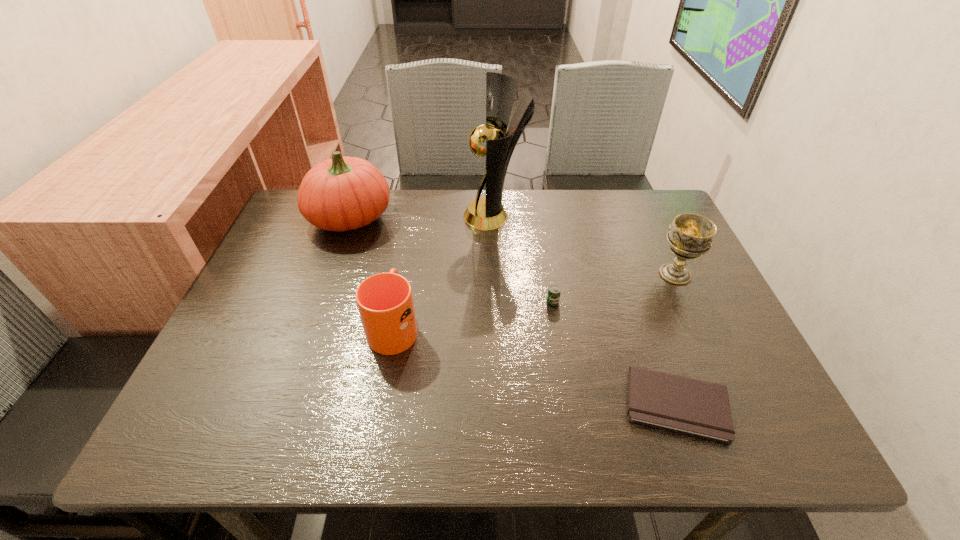
This screenshot has width=960, height=540. I want to click on free space between the fourth nearest object and the second tallest object, so click(x=513, y=246).

You are a GUI agent. You are given a task and a screenshot of the screen. Output one action in this format:
    pyautogui.click(x=<x>, y=<y>)
    Task: Click on the free space between the award and the pumpkin
    Image resolution: width=960 pixels, height=540 pixels.
    Given the screenshot: What is the action you would take?
    pyautogui.click(x=422, y=217)

Identify which object is located as the fifth nearest to the fifth object from right to left. Please provide its 2D coordinates. Your answer should be formatted as a tuple, i.e. [(x, y)], where the tuple contains the x and y coordinates of a point satisfying the conditions above.

[(690, 235)]

Select which object is the third closest to the second object from left to right. Please provide its 2D coordinates. Your answer should be formatted as a tuple, i.e. [(x, y)], where the tuple contains the x and y coordinates of a point satisfying the conditions above.

[(554, 291)]

Find the location of `vacant point that satisfies the following two spatial constraints: 1. at the front of the chalice, where the globe is visible; 2. on the left side of the award`. vacant point that satisfies the following two spatial constraints: 1. at the front of the chalice, where the globe is visible; 2. on the left side of the award is located at coordinates (496, 274).

Where is `vacant space that satisfies the following two spatial constraints: 1. at the front of the award, where the globe is visible; 2. on the left side of the fourth nearest object`? The height and width of the screenshot is (540, 960). vacant space that satisfies the following two spatial constraints: 1. at the front of the award, where the globe is visible; 2. on the left side of the fourth nearest object is located at coordinates (496, 274).

Identify the location of free space that satisfies the following two spatial constraints: 1. at the front of the tallest object, where the globe is visible; 2. on the left side of the beer can. The image size is (960, 540). (497, 302).

Find the location of a particular element. This screenshot has height=540, width=960. free space in the image that satisfies the following two spatial constraints: 1. at the front of the award, where the globe is visible; 2. on the left side of the chalice is located at coordinates click(x=496, y=274).

At what (x,y) coordinates should I click in order to perform the action: click on free spot that satisfies the following two spatial constraints: 1. at the front of the nearest object, where the globe is visible; 2. on the left side of the tallest object. Please return your answer as a coordinate pair (x, y). Image resolution: width=960 pixels, height=540 pixels. Looking at the image, I should click on (502, 404).

The height and width of the screenshot is (540, 960). What are the coordinates of `vacant space that satisfies the following two spatial constraints: 1. on the handle side of the third farthest object; 2. on the left side of the mug` in the screenshot? It's located at (403, 274).